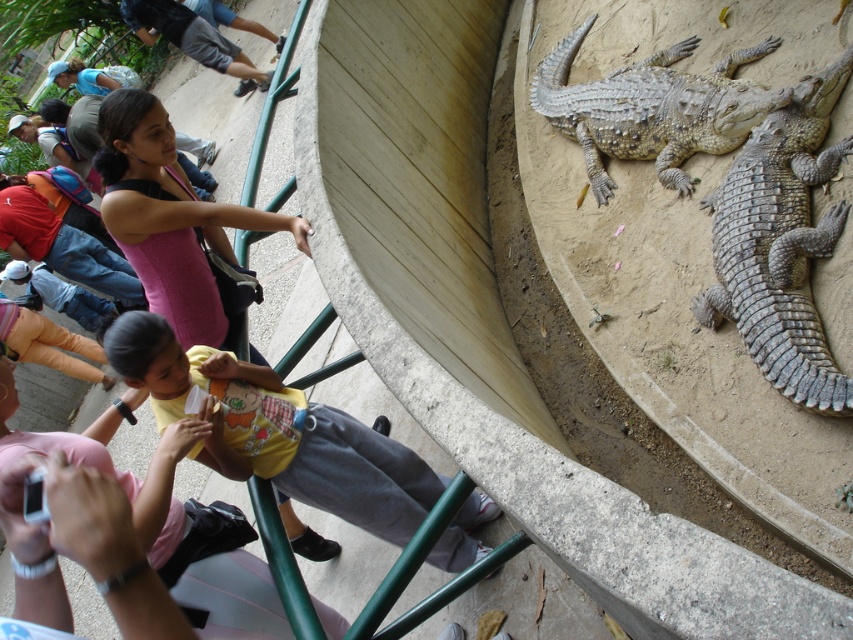
Between gray textured crocodile at right and gray scaly crocodile at upper right, which one appears on the left side from the viewer's perspective?

From the viewer's perspective, gray scaly crocodile at upper right appears more on the left side.

Between point (772, 355) and point (642, 128), which one is positioned in front?

Point (772, 355) is more forward.

Identify the location of gray textured crocodile at right. The height and width of the screenshot is (640, 853). (780, 244).

Between yellow cotton shirt at center and gray textured crocodile at right, which one appears on the right side from the viewer's perspective?

From the viewer's perspective, gray textured crocodile at right appears more on the right side.

In the scene shown: Can you confirm if yellow cotton shirt at center is bigger than gray textured crocodile at right?

Indeed, yellow cotton shirt at center has a larger size compared to gray textured crocodile at right.

This screenshot has height=640, width=853. Find the location of `yellow cotton shirt at center`. yellow cotton shirt at center is located at coordinates (277, 432).

Based on the photo, is yellow cotton shirt at center below gray scaly crocodile at upper right?

Correct, yellow cotton shirt at center is located below gray scaly crocodile at upper right.

You are a GUI agent. You are given a task and a screenshot of the screen. Output one action in this format:
    pyautogui.click(x=<x>, y=<y>)
    Task: Click on the yellow cotton shirt at center
    
    Given the screenshot: What is the action you would take?
    pyautogui.click(x=277, y=432)